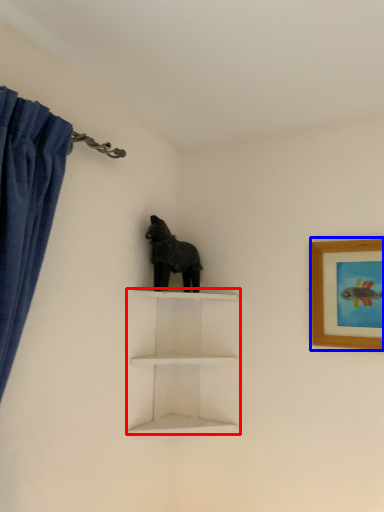
Question: Which point is further to the camera, shelf (highlighted by a red box) or picture frame (highlighted by a blue box)?

Choices:
 (A) shelf
 (B) picture frame

Answer: (A)